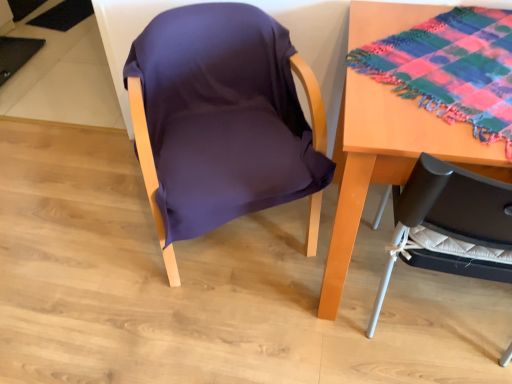
Question: Looking at their shapes, would you say multicolored woven cloth at upper right is wider or thinner than wooden table at right?

Choices:
 (A) wide
 (B) thin

Answer: (A)

Question: From a real-world perspective, relative to wooden table at right, is multicolored woven cloth at upper right vertically above or below?

Choices:
 (A) above
 (B) below

Answer: (A)

Question: Which is farther from the wooden table at right?

Choices:
 (A) purple fabric chair at center
 (B) multicolored woven cloth at upper right

Answer: (A)

Question: Which is nearer to the purple fabric chair at center?

Choices:
 (A) multicolored woven cloth at upper right
 (B) wooden table at right

Answer: (B)